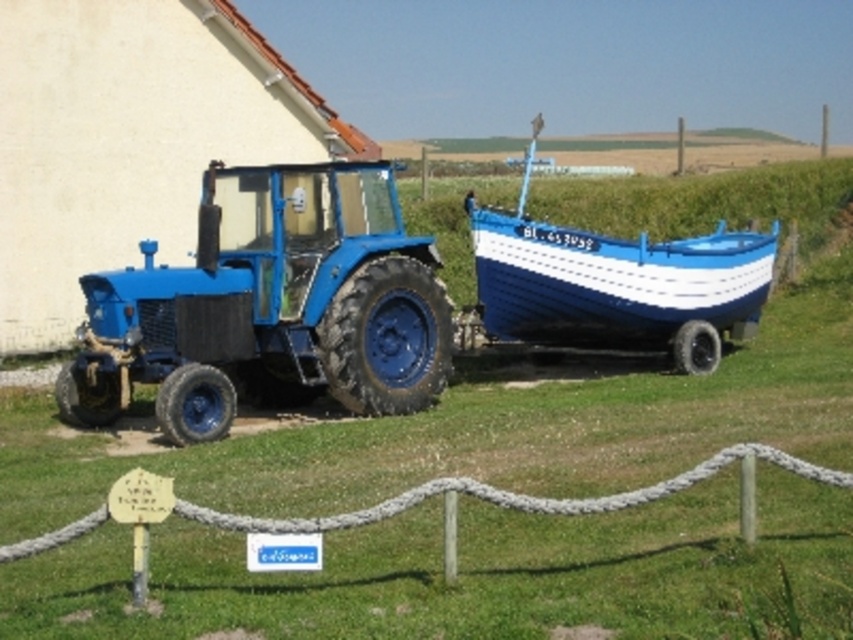
You are a farmer who needs to move the blue painted wood boat at right to the lake located behind the matte blue tractor at left. Can you drive the tractor directly backward to move the boat towards the lake without adjusting the tractor and boat positions?

The matte blue tractor at left is positioned on the left side of the blue painted wood boat at right. Since the tractor is already on the left side of the boat, driving backward directly would move the boat towards the lake located behind the tractor without needing to adjust their positions.

You are a farmer who needs to move the blue painted wood boat at right to a storage shed located 15 feet away from the matte blue tractor at left. Can you safely transport the boat to the shed without detaching it from the tractor?

The matte blue tractor at left is 12.07 feet away from the blue painted wood boat at right. Since the shed is 15 feet away from the tractor, the distance between the boat and the shed would be approximately 15 feet minus 12.07 feet, which is about 2.93 feet. This means the boat is already within close proximity to the shed, so you can safely transport it without detaching.

You are standing in the field and want to take a photo of the tractor and boat. You notice two points marked on the image at coordinates point (x=282, y=307) and point (x=688, y=362). Which point should you focus on to ensure the tractor and boat are in sharp focus?

You should focus on point (x=282, y=307) because it is closer to the camera than point (x=688, y=362), ensuring the tractor and boat are in focus.